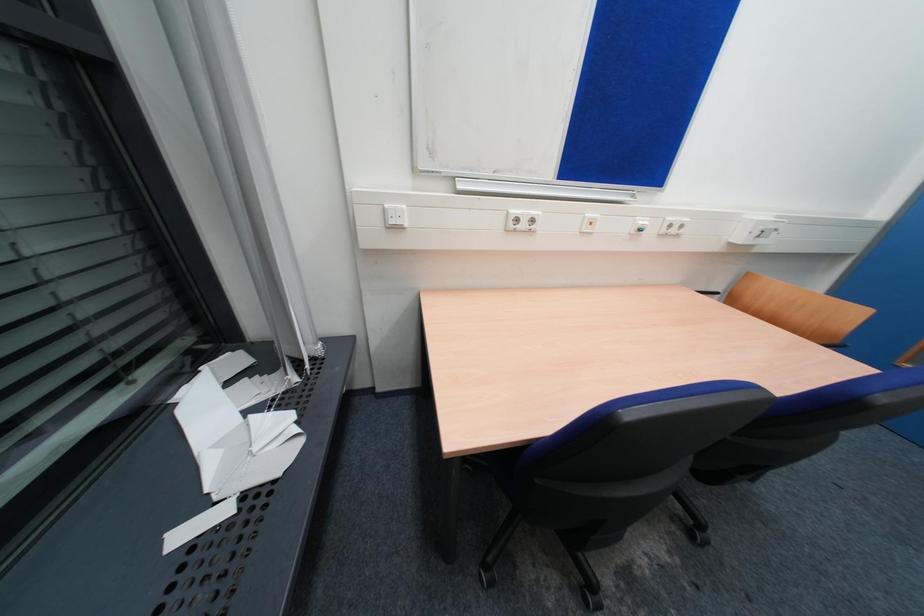
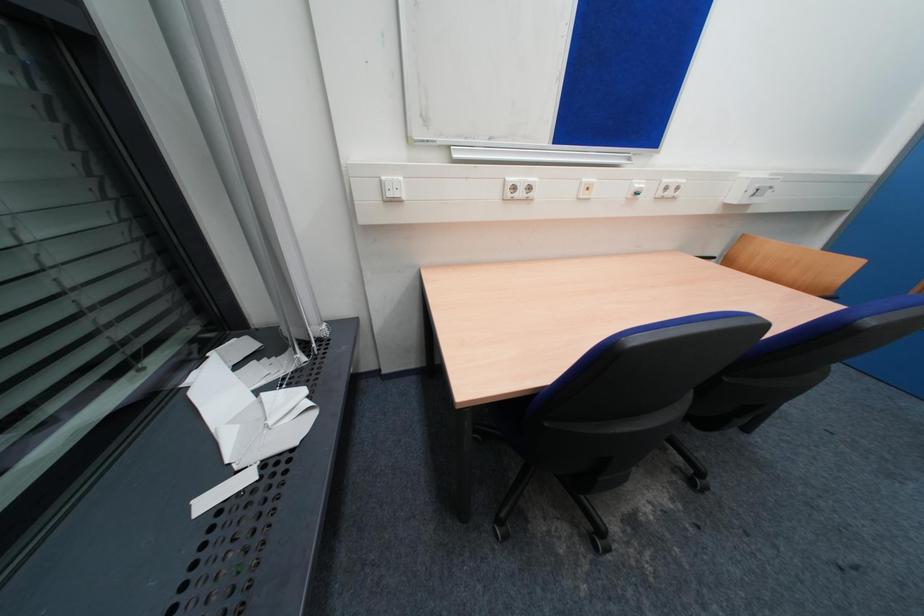
The images are taken continuously from a first-person perspective. In which direction are you moving?

The cameraman walked toward left, backward.